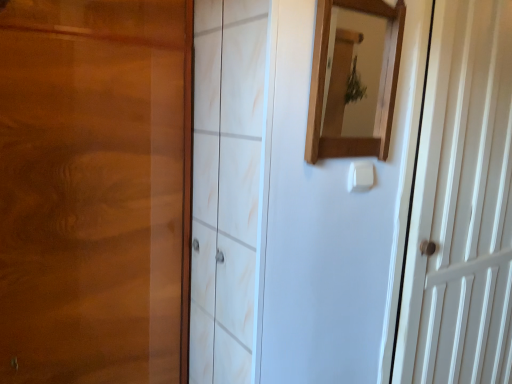
Question: Does white wooden door at right lie behind wooden mirror at upper center?

Choices:
 (A) no
 (B) yes

Answer: (B)

Question: Can you confirm if white wooden door at right is taller than wooden mirror at upper center?

Choices:
 (A) yes
 (B) no

Answer: (A)

Question: Does white wooden door at right appear on the left side of wooden mirror at upper center?

Choices:
 (A) yes
 (B) no

Answer: (B)

Question: Is white wooden door at right directly adjacent to wooden mirror at upper center?

Choices:
 (A) yes
 (B) no

Answer: (B)

Question: Considering the relative sizes of white wooden door at right and wooden mirror at upper center in the image provided, is white wooden door at right wider than wooden mirror at upper center?

Choices:
 (A) no
 (B) yes

Answer: (B)

Question: Is wooden mirror at upper center inside the boundaries of white plastic light switch at center, or outside?

Choices:
 (A) inside
 (B) outside

Answer: (B)

Question: Considering the positions of wooden mirror at upper center and white plastic light switch at center in the image, is wooden mirror at upper center bigger or smaller than white plastic light switch at center?

Choices:
 (A) small
 (B) big

Answer: (B)

Question: From the image's perspective, is wooden mirror at upper center positioned above or below white plastic light switch at center?

Choices:
 (A) above
 (B) below

Answer: (A)

Question: Is wooden mirror at upper center wider or thinner than white plastic light switch at center?

Choices:
 (A) thin
 (B) wide

Answer: (B)

Question: Based on their sizes in the image, would you say white plastic light switch at center is bigger or smaller than white wooden door at right?

Choices:
 (A) big
 (B) small

Answer: (B)

Question: Is point (366, 162) closer or farther from the camera than point (462, 21)?

Choices:
 (A) closer
 (B) farther

Answer: (A)

Question: From their relative heights in the image, would you say white plastic light switch at center is taller or shorter than white wooden door at right?

Choices:
 (A) tall
 (B) short

Answer: (B)

Question: Considering the relative positions of white plastic light switch at center and white wooden door at right in the image provided, is white plastic light switch at center to the left or to the right of white wooden door at right?

Choices:
 (A) right
 (B) left

Answer: (B)

Question: Do you think white wooden door at right is within wooden mirror at upper center, or outside of it?

Choices:
 (A) outside
 (B) inside

Answer: (A)

Question: Visually, is white wooden door at right positioned to the left or to the right of wooden mirror at upper center?

Choices:
 (A) right
 (B) left

Answer: (A)